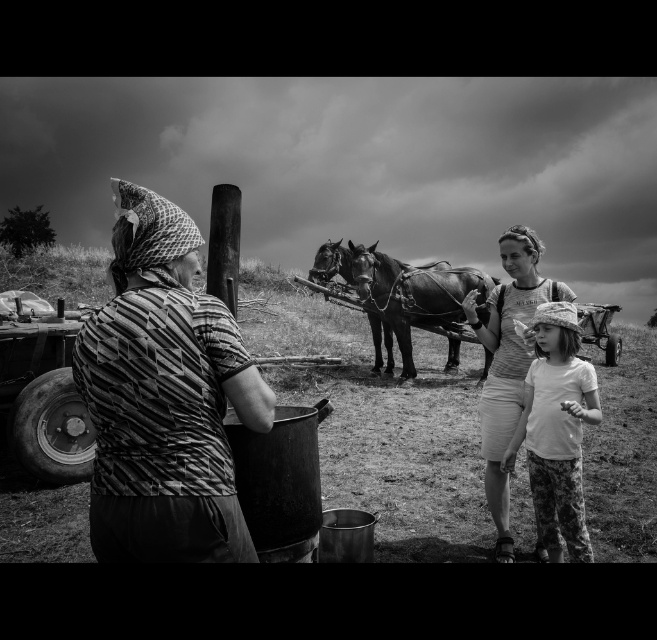
Question: Which of the following is the farthest from the observer?

Choices:
 (A) (154, 403)
 (B) (532, 449)

Answer: (B)

Question: Based on their relative distances, which object is nearer to the striped fabric at center?

Choices:
 (A) smooth leather horse at center
 (B) white cotton shirt at lower right

Answer: (B)

Question: Can you confirm if white cotton shirt at lower right is bigger than matte fabric woman at center?

Choices:
 (A) yes
 (B) no

Answer: (B)

Question: Is matte fabric woman at center smaller than smooth leather horse at center?

Choices:
 (A) yes
 (B) no

Answer: (A)

Question: Which object appears closest to the camera in this image?

Choices:
 (A) striped fabric at center
 (B) matte fabric woman at center

Answer: (A)

Question: In this image, where is striped fabric at center located relative to smooth leather horse at center?

Choices:
 (A) above
 (B) below

Answer: (B)